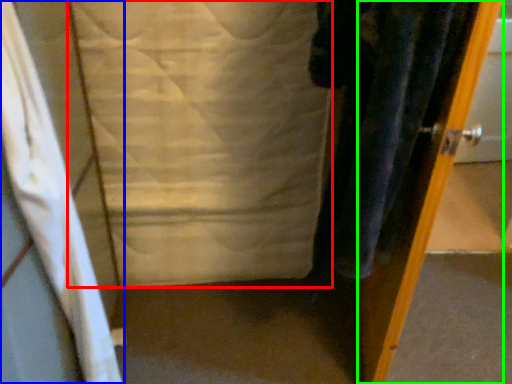
Question: Which is farther away from sheet (highlighted by a red box)? curtain (highlighted by a blue box) or door (highlighted by a green box)?

Choices:
 (A) curtain
 (B) door

Answer: (B)